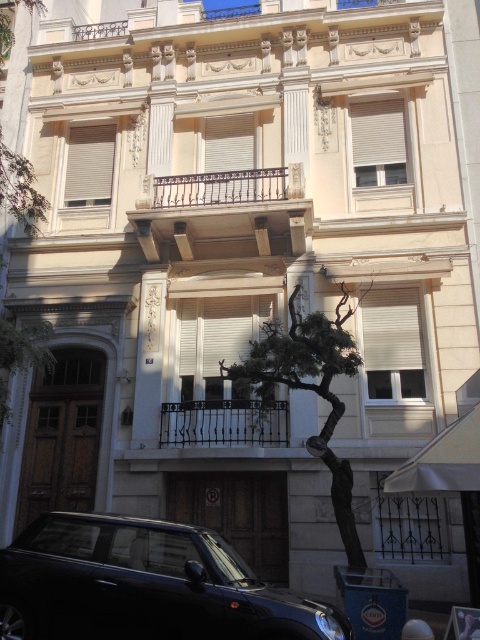
Which is behind, point (247, 609) or point (344, 362)?

The point (344, 362) is behind.

Can you confirm if shiny black car at lower left is taller than green textured tree at center?

No, shiny black car at lower left is not taller than green textured tree at center.

Who is more forward, (158, 552) or (261, 339)?

Point (158, 552) is more forward.

At what (x,y) coordinates should I click in order to perform the action: click on shiny black car at lower left. Please return your answer as a coordinate pair (x, y). Image resolution: width=480 pixels, height=640 pixels. Looking at the image, I should click on (144, 586).